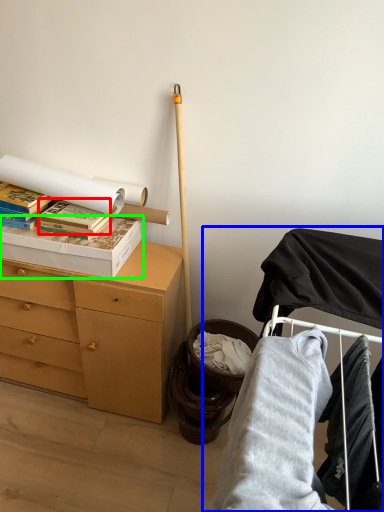
Question: Which is farther away from paperback book (highlighted by a red box)? bunk bed (highlighted by a blue box) or box (highlighted by a green box)?

Choices:
 (A) bunk bed
 (B) box

Answer: (A)